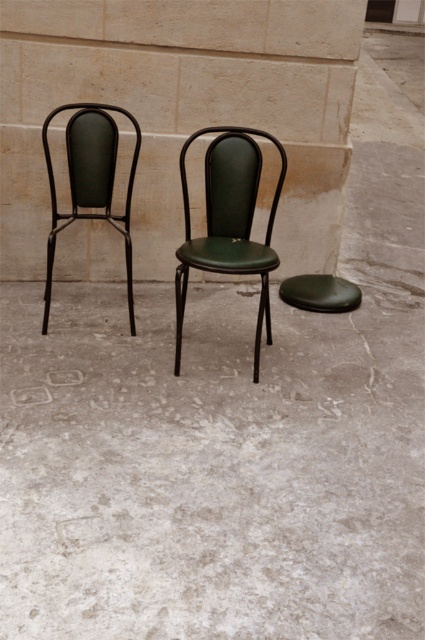
You are standing in a room with two chairs. You need to reach a specific point marked at coordinates point (99, 200). Given that the distance from you to this point is 12.57 feet, can you estimate how far you need to walk to reach it?

The distance of point (99, 200) from viewer is 12.57 feet, so you need to walk 12.57 feet to reach it.

You are standing in front of two chairs. You see the green matte chair at left and the green leather stool at center. Which one is positioned more to the left side?

The green matte chair at left is positioned more to the left side than the green leather stool at center.

You are standing in front of two chairs. You need to sit on the one that is closer to you. Which chair should you choose between the green leather chair at center and the green matte chair at left?

You should choose the green leather chair at center because it is closer to the viewer than the green matte chair at left.